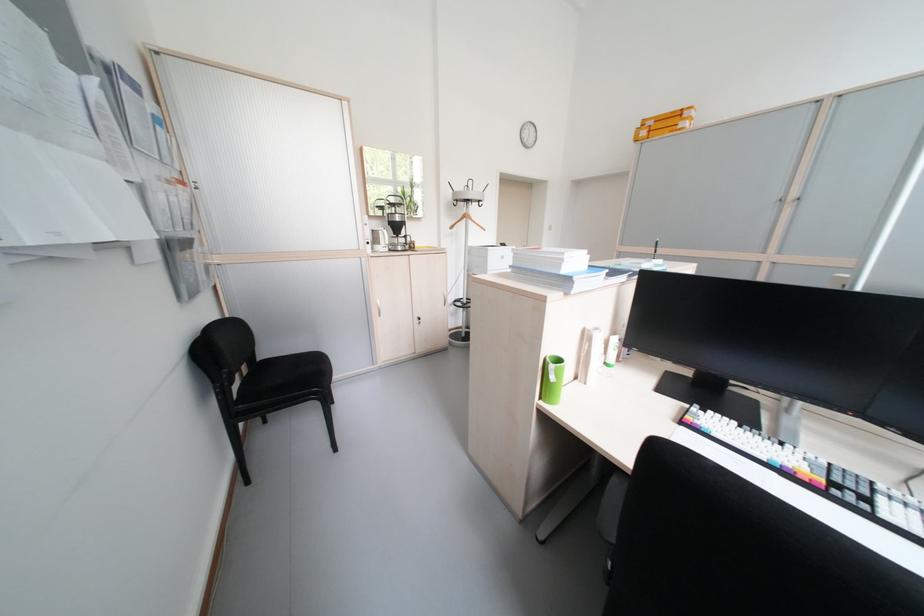
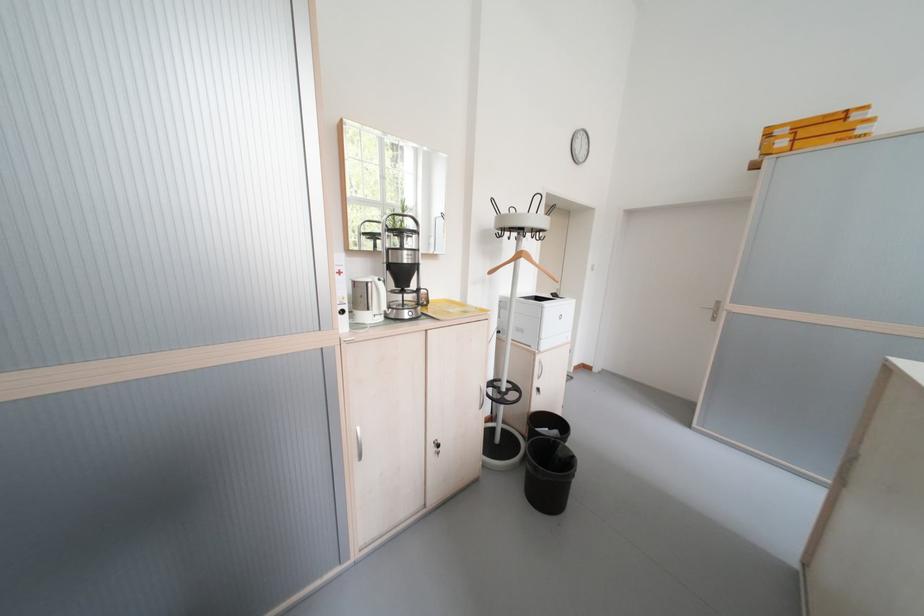
The point at (478, 203) is marked in the first image. Where is the corresponding point in the second image?

(531, 232)